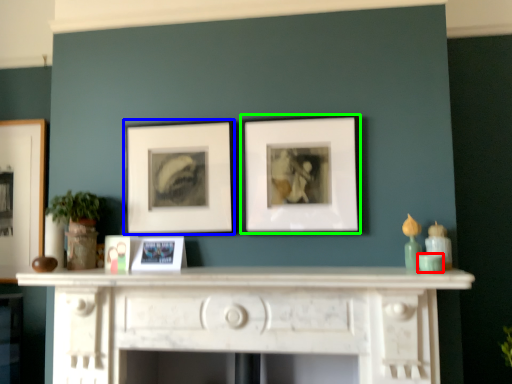
Question: Considering the real-world distances, which object is farthest from teal (highlighted by a red box)? picture frame (highlighted by a blue box) or picture frame (highlighted by a green box)?

Choices:
 (A) picture frame
 (B) picture frame

Answer: (A)